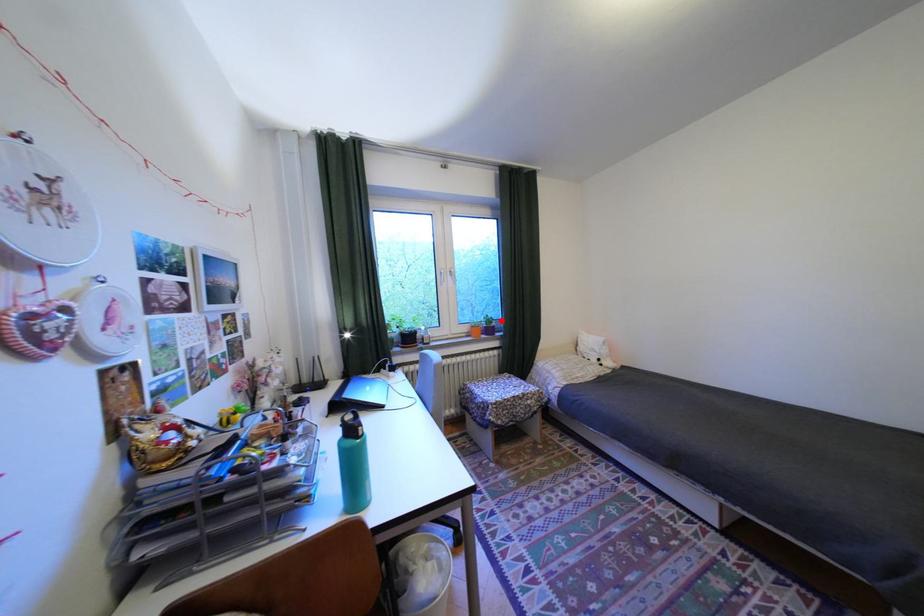
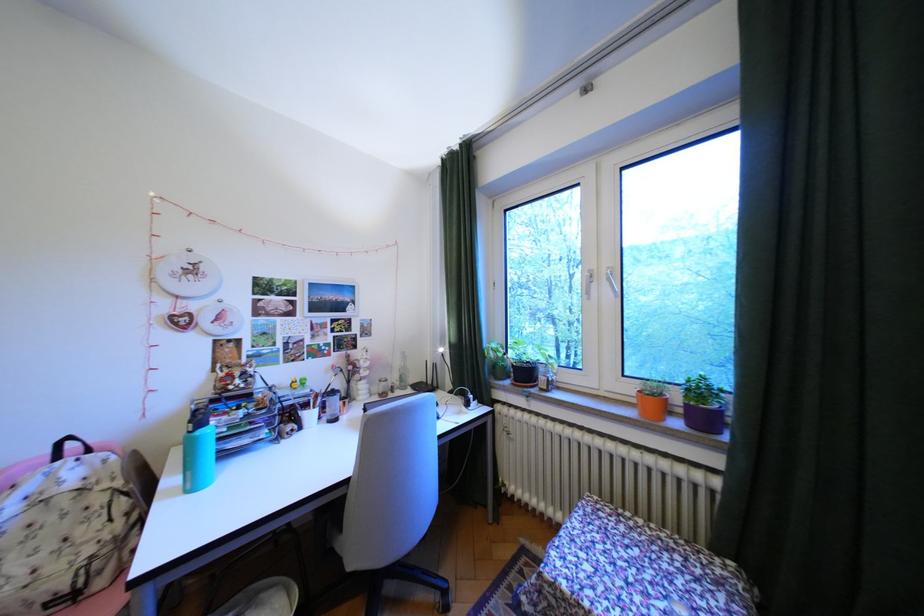
Where in the second image is the point corresponding to the highlighted location from the first image?

(710, 391)